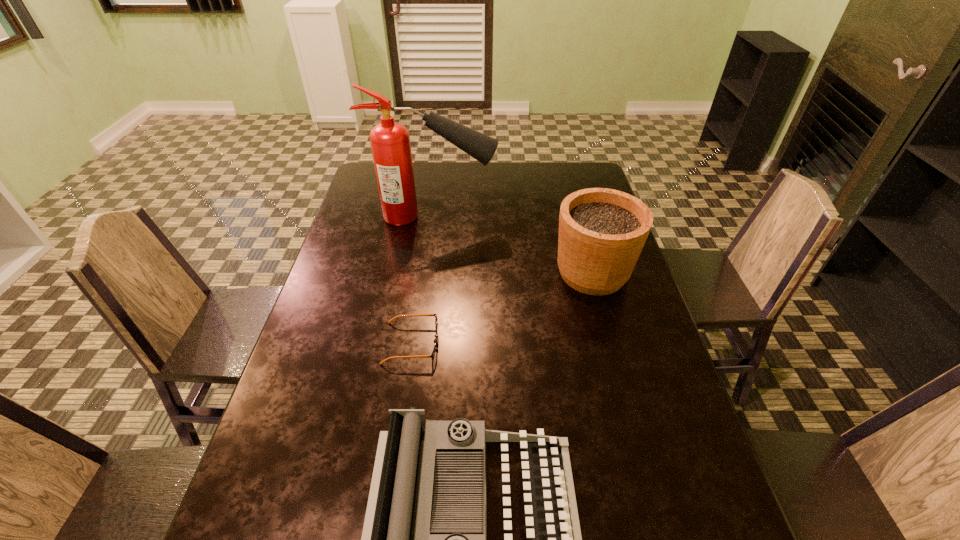
Where is `fire extinguisher`? The height and width of the screenshot is (540, 960). fire extinguisher is located at coordinates (390, 141).

You are a GUI agent. You are given a task and a screenshot of the screen. Output one action in this format:
    pyautogui.click(x=<x>, y=<y>)
    Task: Click on the tallest object
    
    Given the screenshot: What is the action you would take?
    pyautogui.click(x=390, y=141)

The height and width of the screenshot is (540, 960). Find the location of `flowerpot`. flowerpot is located at coordinates (602, 232).

Where is `the rightmost object`? the rightmost object is located at coordinates pos(602,232).

What are the coordinates of `the second nearest object` in the screenshot? It's located at (432, 355).

Locate an element on the screen. This screenshot has width=960, height=540. the shortest object is located at coordinates (432, 355).

What are the coordinates of `vacant space located 0.170m at the nozzle of the farthest object` in the screenshot? It's located at (545, 217).

Locate an element on the screen. This screenshot has height=540, width=960. vacant space located on the front of the third nearest object is located at coordinates [624, 389].

Locate an element on the screen. The image size is (960, 540). free space located on the front-facing side of the second nearest object is located at coordinates (529, 343).

Image resolution: width=960 pixels, height=540 pixels. Find the location of `object located at the left edge`. object located at the left edge is located at coordinates (390, 141).